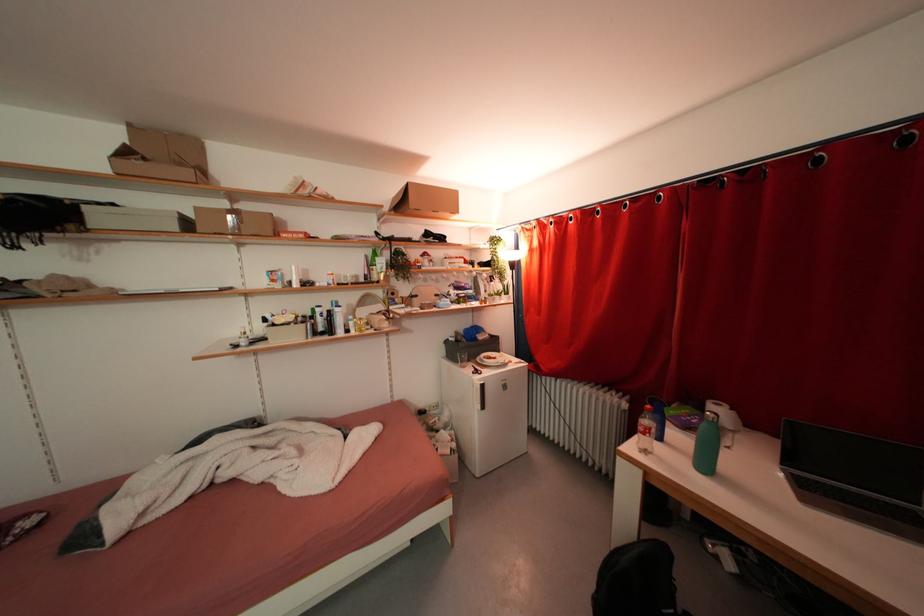
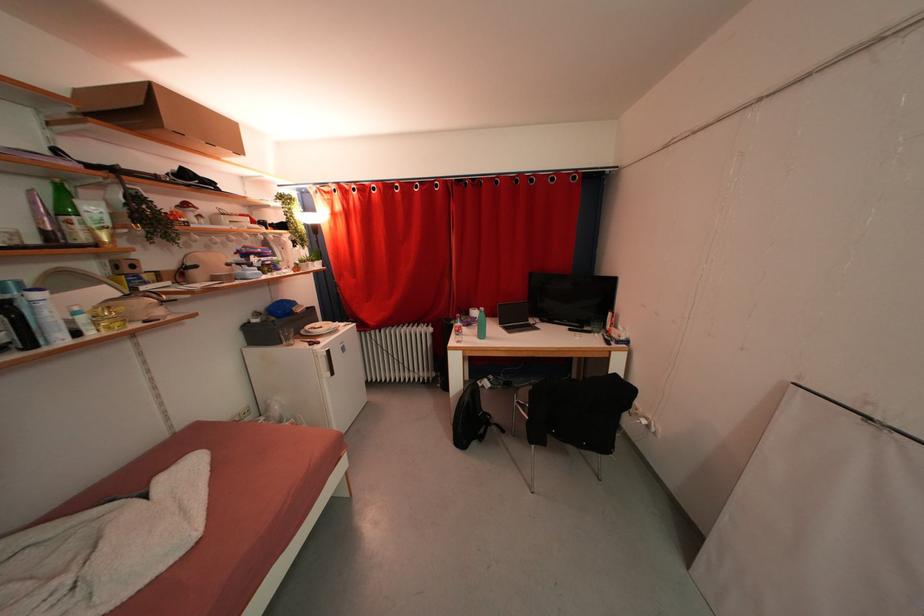
Question: The camera is either moving clockwise (left) or counter-clockwise (right) around the object. The first image is from the beginning of the video and the second image is from the end. Is the camera moving left or right when shooting the video?

Choices:
 (A) Left
 (B) Right

Answer: (A)